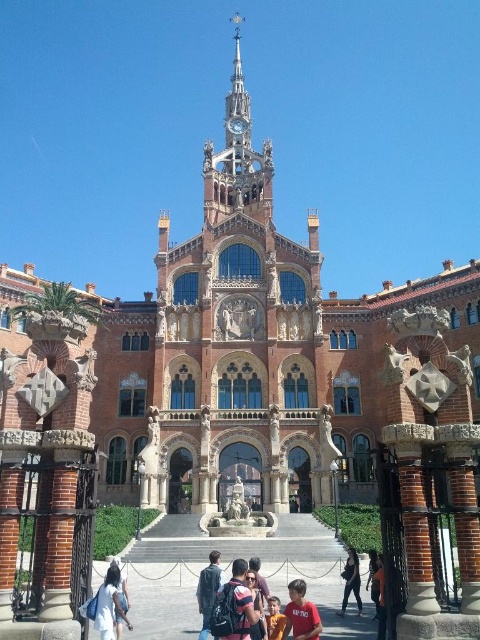
Question: Where is denim jacket at lower right located in relation to striped fabric backpack at center in the image?

Choices:
 (A) below
 (B) above

Answer: (A)

Question: Considering the real-world distances, which object is farthest from the striped fabric backpack at center?

Choices:
 (A) matte black backpack at center
 (B) dark blue fabric jacket at lower center
 (C) orange shirt at center
 (D) red shirt at lower center

Answer: (B)

Question: Which of the following is the closest to the observer?

Choices:
 (A) (111, 634)
 (B) (349, 579)

Answer: (A)

Question: Observing the image, what is the correct spatial positioning of matte black backpack at center in reference to striped fabric backpack at center?

Choices:
 (A) left
 (B) right

Answer: (A)

Question: Is red shirt at lower center behind striped fabric backpack at center?

Choices:
 (A) yes
 (B) no

Answer: (B)

Question: Which point is closer to the camera taking this photo?

Choices:
 (A) (344, 577)
 (B) (259, 611)

Answer: (B)